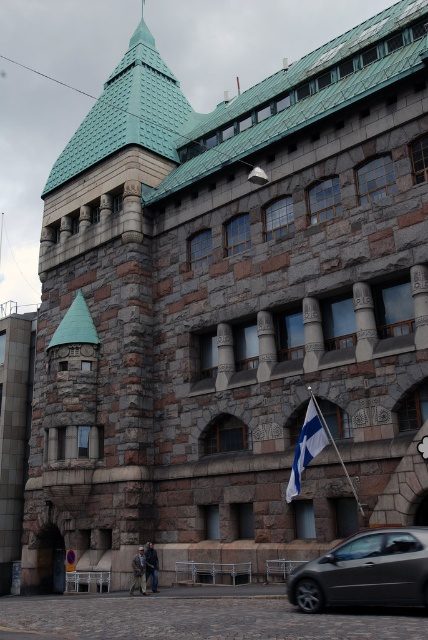
Question: Which point is farther from the camera taking this photo?

Choices:
 (A) (299, 486)
 (B) (357, 566)

Answer: (A)

Question: Can you confirm if metallic gray car at lower right is bigger than white fabric flag at center?

Choices:
 (A) yes
 (B) no

Answer: (B)

Question: Does metallic gray car at lower right appear over white fabric flag at center?

Choices:
 (A) no
 (B) yes

Answer: (A)

Question: Is the position of metallic gray car at lower right less distant than that of white fabric flag at center?

Choices:
 (A) no
 (B) yes

Answer: (B)